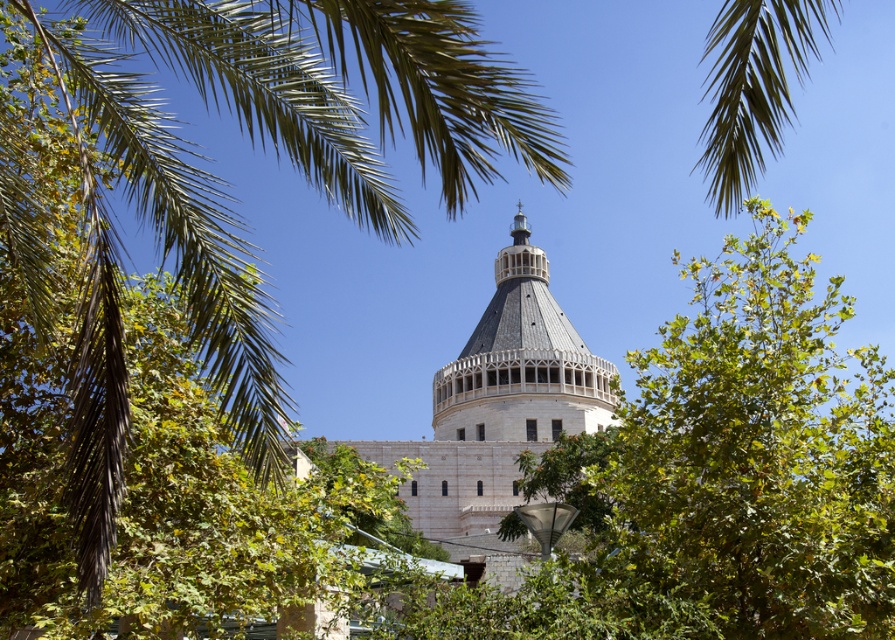
Question: Can you confirm if green leafy palm at upper left is positioned below stone dome at center?

Choices:
 (A) no
 (B) yes

Answer: (A)

Question: Which object is the closest to the green leafy palm at upper left?

Choices:
 (A) stone dome at center
 (B) stone textured dome at center

Answer: (A)

Question: Is stone dome at center wider than stone textured dome at center?

Choices:
 (A) yes
 (B) no

Answer: (A)

Question: Among these objects, which one is nearest to the camera?

Choices:
 (A) green leafy palm at upper left
 (B) stone textured dome at center

Answer: (A)

Question: Which is farther from the stone textured dome at center?

Choices:
 (A) stone dome at center
 (B) green leafy palm at upper left

Answer: (B)

Question: Is green leafy palm at upper left closer to the viewer compared to stone textured dome at center?

Choices:
 (A) no
 (B) yes

Answer: (B)